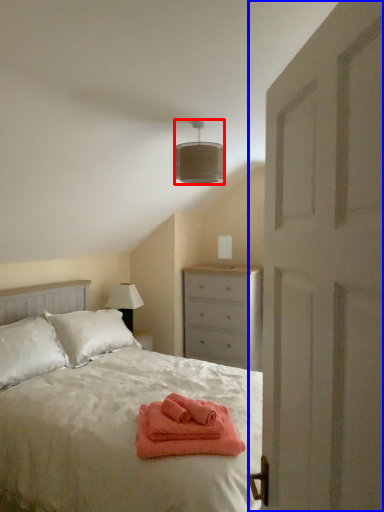
Question: Which object appears closest to the camera in this image, lamp (highlighted by a red box) or door (highlighted by a blue box)?

Choices:
 (A) lamp
 (B) door

Answer: (B)